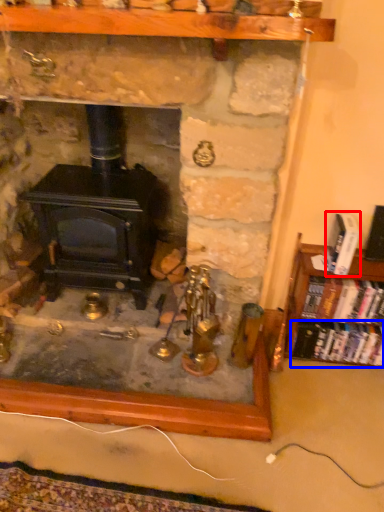
Question: Which point is further to the camera, book (highlighted by a red box) or book (highlighted by a blue box)?

Choices:
 (A) book
 (B) book

Answer: (B)